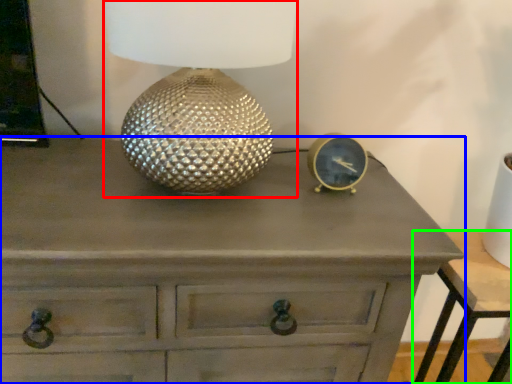
Question: Which is farther away from table lamp (highlighted by a red box)? chest of drawers (highlighted by a blue box) or nightstand (highlighted by a green box)?

Choices:
 (A) chest of drawers
 (B) nightstand

Answer: (B)